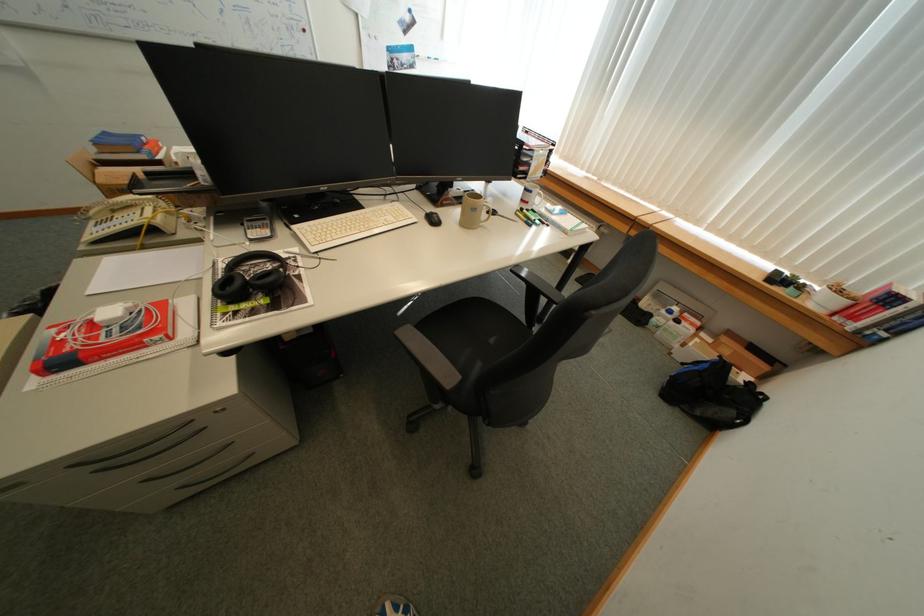
Which object does [432,217] point to?

This point indicates the black computer mouse.